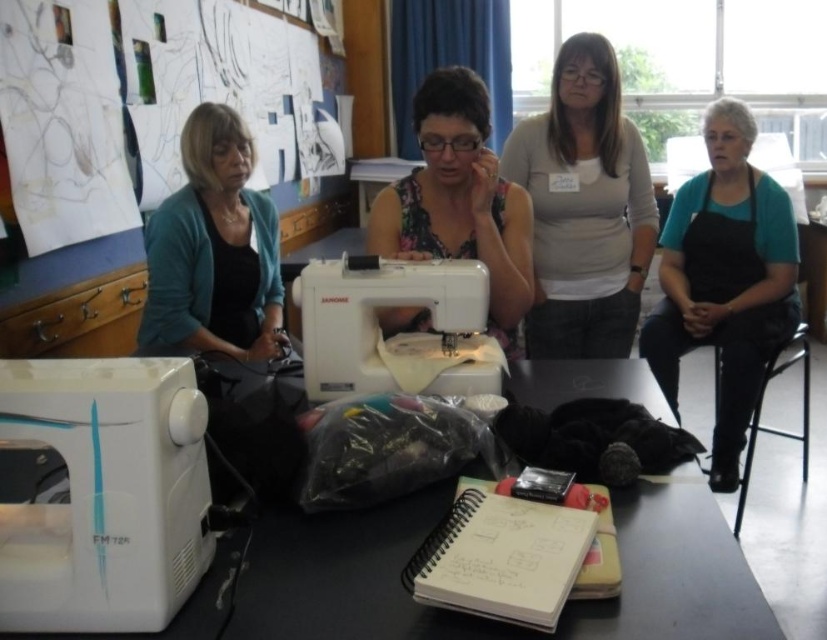
Who is shorter, white plastic table at center or teal fabric apron at right?

white plastic table at center is shorter.

Is white plastic table at center below teal fabric apron at right?

Yes, white plastic table at center is below teal fabric apron at right.

Is point (519, 632) positioned behind point (720, 424)?

No, it is not.

Locate an element on the screen. This screenshot has width=827, height=640. white plastic table at center is located at coordinates (484, 620).

Can you confirm if floral fabric at center is positioned above black plastic stool at lower right?

Yes.

From the picture: Does floral fabric at center have a smaller size compared to black plastic stool at lower right?

Correct, floral fabric at center occupies less space than black plastic stool at lower right.

Who is more distant from viewer, (424,195) or (713,385)?

Point (713,385)

Locate an element on the screen. floral fabric at center is located at coordinates pos(459,198).

Consider the image. Who is higher up, white plastic table at center or black plastic stool at lower right?

Positioned higher is black plastic stool at lower right.

Consider the image. Does white plastic table at center come behind black plastic stool at lower right?

No, white plastic table at center is closer to the viewer.

Between point (529, 365) and point (739, 506), which one is positioned behind?

The point (739, 506) is more distant.

Image resolution: width=827 pixels, height=640 pixels. Identify the location of white plastic table at center. (484, 620).